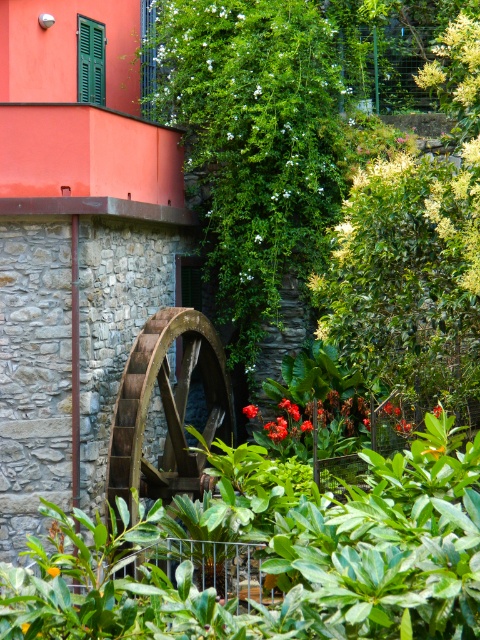
You are standing in front of the stone building and notice both the brown wooden wheel at center and the orange matte flower at center. Which object is positioned higher from the ground?

The brown wooden wheel at center is located above the orange matte flower at center, so it is positioned higher from the ground.

You are standing at the point with coordinates point [168,408]. What object are you standing on?

You are standing on the brown wooden wheel at center represented by point [168,408].